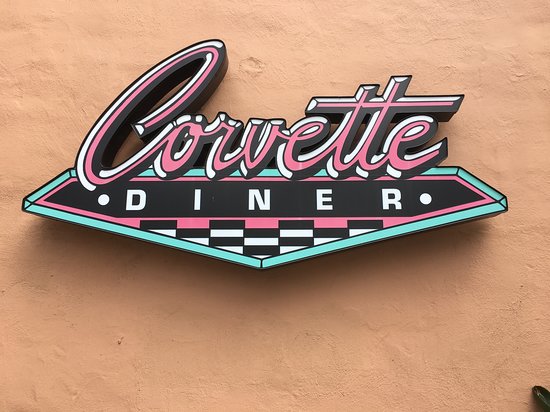
The width and height of the screenshot is (550, 412). Find the location of `brown table`. brown table is located at coordinates (532, 109).